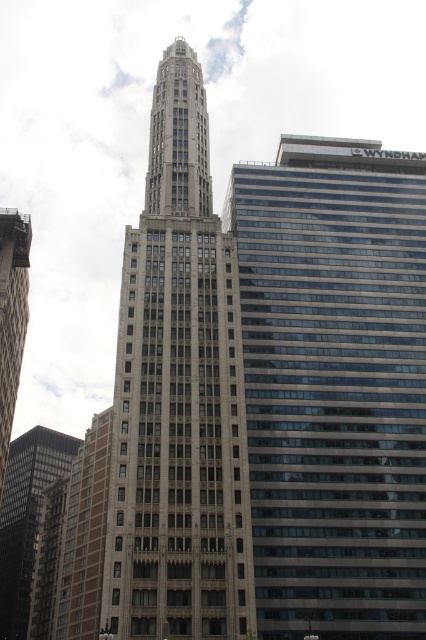
Question: Can you confirm if gray stone tower at center is thinner than dark gray stone tower at lower left?

Choices:
 (A) no
 (B) yes

Answer: (B)

Question: Which of the following is the closest to the observer?

Choices:
 (A) (417, 556)
 (B) (26, 266)
 (C) (161, 481)
 (D) (48, 442)

Answer: (A)

Question: Is dark gray stone tower at lower left bigger than matte glass skyscraper at left?

Choices:
 (A) yes
 (B) no

Answer: (B)

Question: Which of the following is the farthest from the observer?

Choices:
 (A) matte glass skyscraper at left
 (B) dark gray stone tower at lower left
 (C) gray stone tower at center

Answer: (B)

Question: Which point appears farthest from the camera in this image?

Choices:
 (A) (3, 346)
 (B) (17, 538)

Answer: (B)

Question: Can you confirm if gray stone tower at center is smaller than dark gray stone tower at lower left?

Choices:
 (A) no
 (B) yes

Answer: (A)